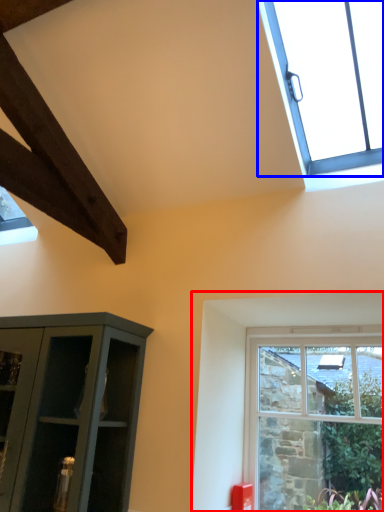
Question: Which object is further to the camera taking this photo, window (highlighted by a red box) or window (highlighted by a blue box)?

Choices:
 (A) window
 (B) window

Answer: (A)